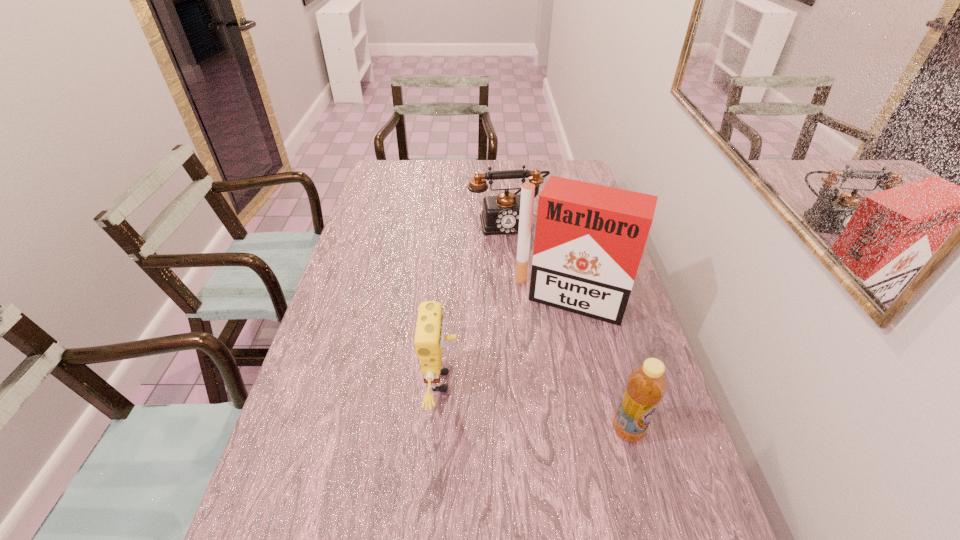
The image size is (960, 540). What are the coordinates of `empty location between the bottle and the telephone` in the screenshot? It's located at (567, 326).

Identify the location of free spot between the farthest object and the bottle. This screenshot has height=540, width=960. (567, 326).

Locate an element on the screen. vacant point located between the tallest object and the sponge is located at coordinates (507, 340).

Locate an element on the screen. The image size is (960, 540). free spot between the bottle and the second farthest object is located at coordinates point(600,365).

You are a GUI agent. You are given a task and a screenshot of the screen. Output one action in this format:
    pyautogui.click(x=<x>, y=<y>)
    Task: Click on the free space between the cigarette case and the sponge
    The width and height of the screenshot is (960, 540).
    Given the screenshot: What is the action you would take?
    pyautogui.click(x=507, y=340)

Select which object is the closest to the leftmost object. Please provide its 2D coordinates. Your answer should be formatted as a tuple, i.e. [(x, y)], where the tuple contains the x and y coordinates of a point satisfying the conditions above.

[(589, 239)]

Locate an element on the screen. The image size is (960, 540). object that is the third closest to the cigarette case is located at coordinates (646, 385).

Identify the location of free point that satisfies the following two spatial constraints: 1. on the front side of the bottle; 2. on the left side of the telephone. Image resolution: width=960 pixels, height=540 pixels. (523, 430).